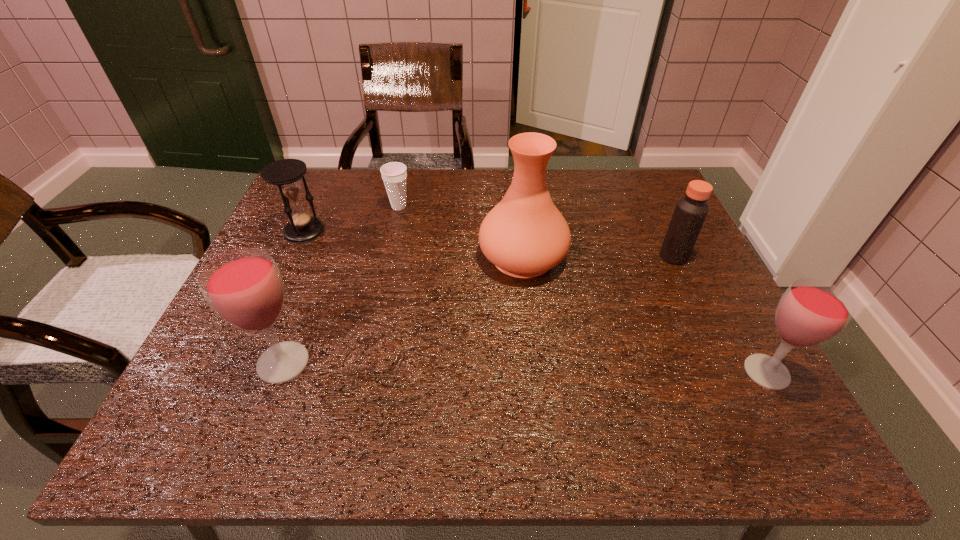
Locate an element on the screen. vacant area situated 0.340m on the left of the shorter wineglass is located at coordinates (569, 372).

Where is `vacant area situated on the right of the cup`? Image resolution: width=960 pixels, height=540 pixels. vacant area situated on the right of the cup is located at coordinates (456, 207).

Identify the location of vacant space positioned on the front of the hourglass. (274, 296).

At what (x,y) coordinates should I click in order to perform the action: click on free location located 0.250m on the front of the vinegar. Please return your answer as a coordinate pair (x, y). The width and height of the screenshot is (960, 540). Looking at the image, I should click on (717, 347).

This screenshot has height=540, width=960. What are the coordinates of `vacant region located on the back of the fourth object from left to right` in the screenshot? It's located at [516, 190].

Where is `object that is at the far edge`? object that is at the far edge is located at coordinates (394, 174).

The height and width of the screenshot is (540, 960). In order to click on wineglass that is at the left edge in this screenshot , I will do `click(244, 287)`.

Locate an element on the screen. This screenshot has width=960, height=540. hourglass at the left edge is located at coordinates (286, 173).

Where is `wineglass situated at the right edge`? wineglass situated at the right edge is located at coordinates (811, 311).

Identify the location of vinegar that is positioned at the right edge. The width and height of the screenshot is (960, 540). (690, 212).